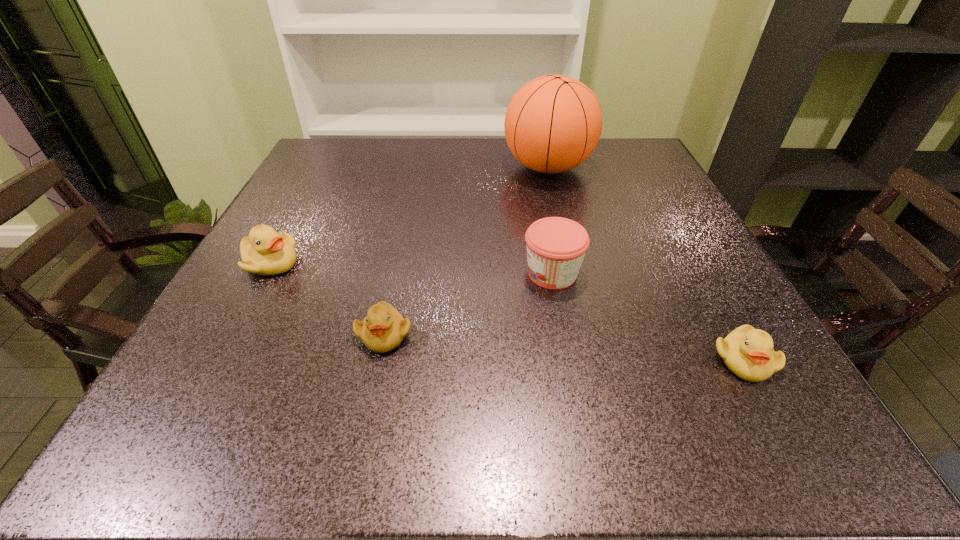
Where is `free space located on the front label of the jam`? The height and width of the screenshot is (540, 960). free space located on the front label of the jam is located at coordinates (329, 273).

Find the location of a particular element. vacant space located on the front-facing side of the leftmost object is located at coordinates (324, 263).

At what (x,y) coordinates should I click in order to perform the action: click on blank space located at the beak of the second duckling from left to right. Please return your answer as a coordinate pair (x, y). Looking at the image, I should click on (371, 400).

Locate an element on the screen. The image size is (960, 540). vacant space located at the face of the rightmost object is located at coordinates (780, 427).

The height and width of the screenshot is (540, 960). I want to click on object that is at the far edge, so click(x=553, y=123).

Locate an element on the screen. Image resolution: width=960 pixels, height=540 pixels. object situated at the left edge is located at coordinates (265, 252).

Where is `object that is at the right edge`? object that is at the right edge is located at coordinates (747, 352).

The height and width of the screenshot is (540, 960). I want to click on vacant area at the far edge, so click(493, 158).

At what (x,y) coordinates should I click in order to perform the action: click on vacant area at the near edge of the desktop. Please return your answer as a coordinate pair (x, y). This screenshot has width=960, height=540. Looking at the image, I should click on (596, 418).

Image resolution: width=960 pixels, height=540 pixels. In the image, there is a desktop. Find the location of `vacant region at the left edge`. vacant region at the left edge is located at coordinates (346, 201).